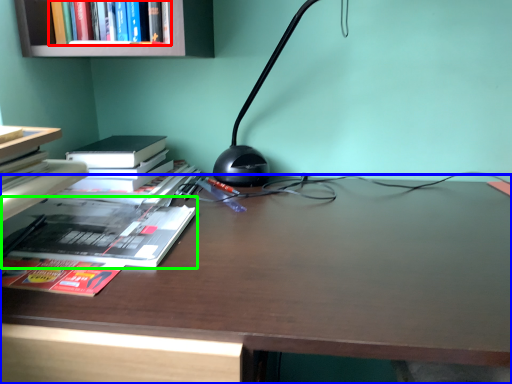
Question: Considering the real-world distances, which object is closest to book (highlighted by a red box)? desk (highlighted by a blue box) or book (highlighted by a green box).

Choices:
 (A) desk
 (B) book

Answer: (B)